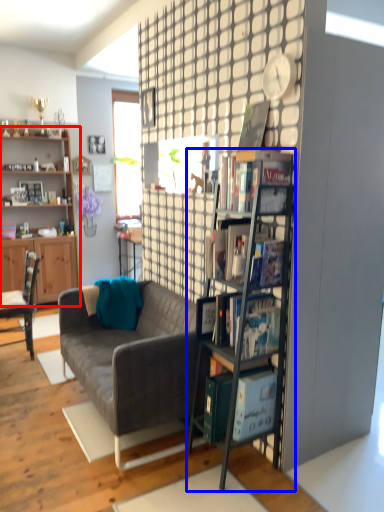
Question: Which point is closer to the camera, shelf (highlighted by a red box) or shelf (highlighted by a blue box)?

Choices:
 (A) shelf
 (B) shelf

Answer: (B)